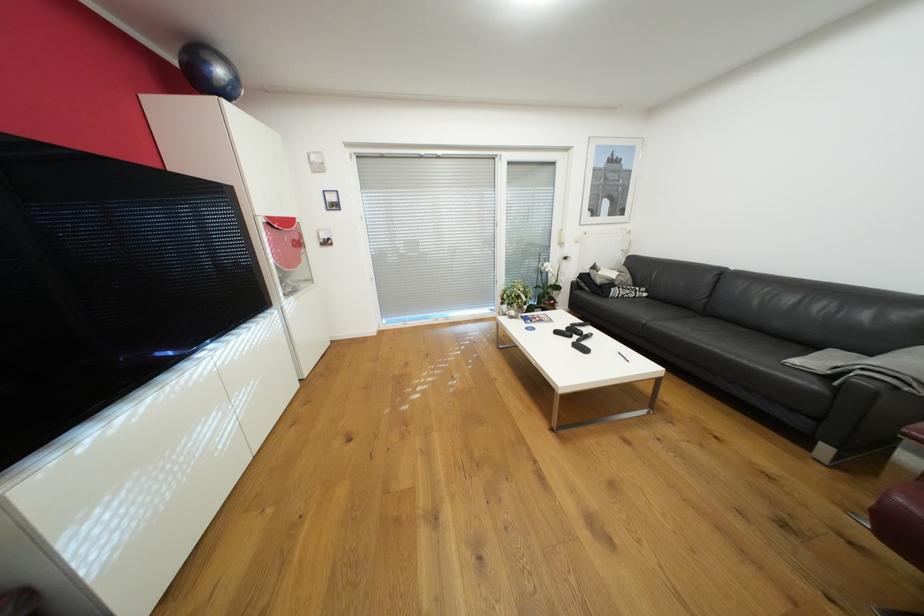
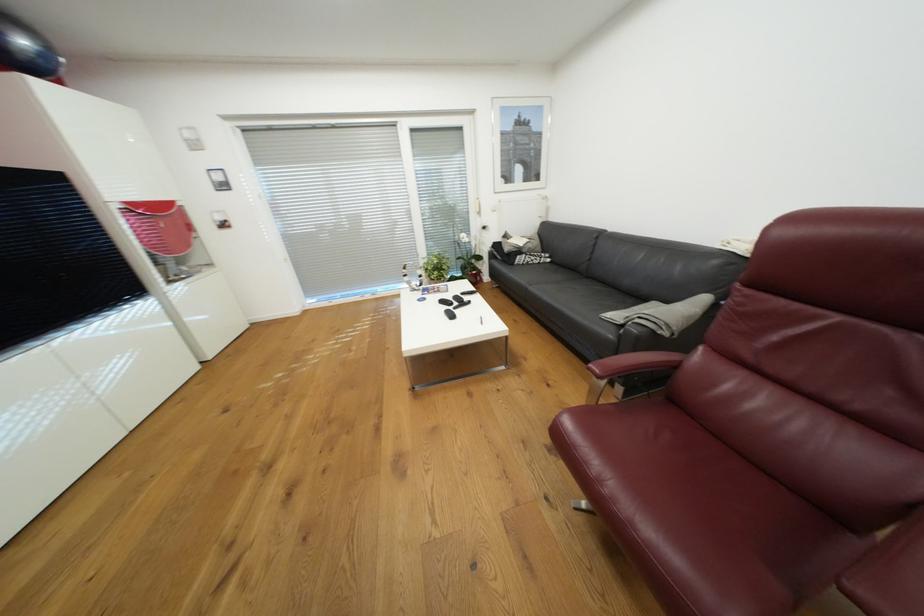
Find the pixel in the second image that matches point 226,71 in the first image.

(29, 42)